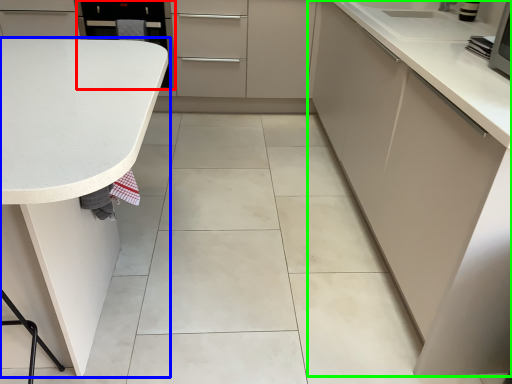
Question: Which object is the closest to the appliance (highlighted by a red box)? Choose among these: countertop (highlighted by a blue box) or cabinetry (highlighted by a green box).

Choices:
 (A) countertop
 (B) cabinetry

Answer: (A)